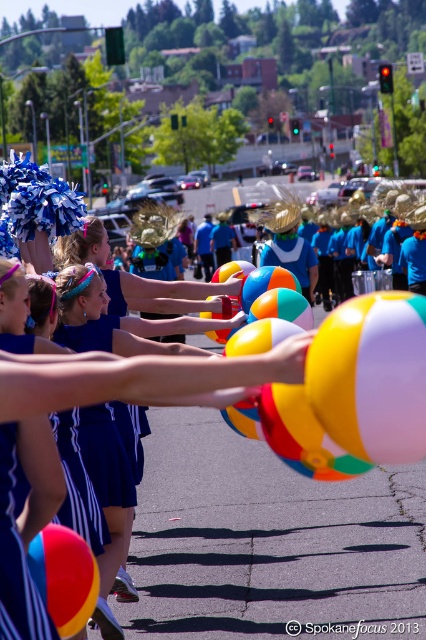
Question: Among these objects, which one is nearest to the camera?

Choices:
 (A) multicolored glossy beach ball at center
 (B) multicolored rubber beach ball at center

Answer: (B)

Question: Does multicolored rubber beach ball at center appear on the left side of multicolored glossy beach ball at center?

Choices:
 (A) yes
 (B) no

Answer: (B)

Question: Is the position of multicolored rubber beach ball at center more distant than that of blue fabric uniform at center?

Choices:
 (A) yes
 (B) no

Answer: (B)

Question: Does multicolored rubber beach ball at center appear on the right side of multicolored glossy beach ball at center?

Choices:
 (A) no
 (B) yes

Answer: (B)

Question: Which object is positioned closest to the blue fabric uniform at center?

Choices:
 (A) multicolored rubber beach ball at center
 (B) multicolored glossy beach ball at center

Answer: (B)

Question: Which point appears farthest from the camera in this image?

Choices:
 (A) (62, 568)
 (B) (327, 413)
 (C) (100, 321)

Answer: (C)